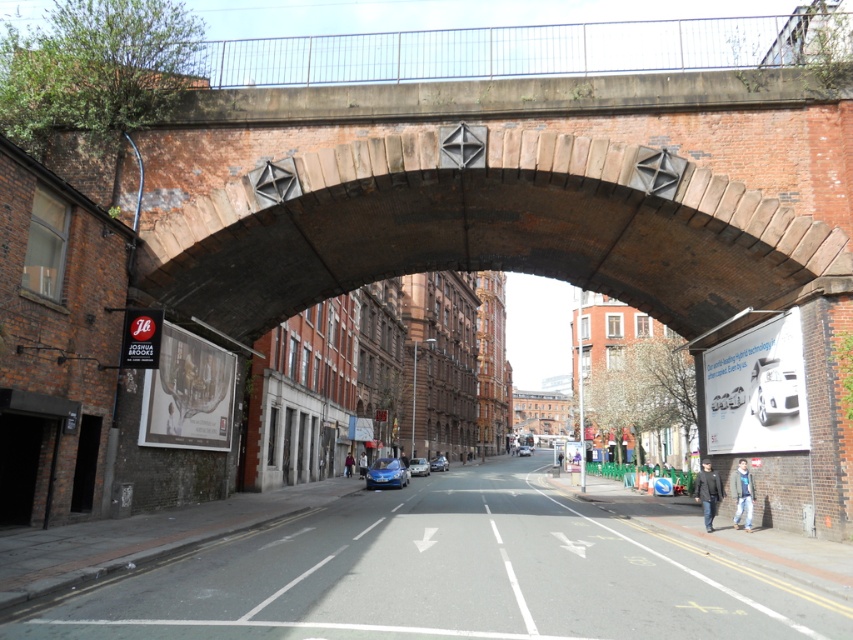
You are a delivery driver who needs to park your metallic blue car at center and blue metallic car at center side by side in a parking lot. Can both cars fit in a parking space that is 6 meters wide?

The metallic blue car at center is wider than the blue metallic car at center. However, without knowing their exact widths, it is impossible to determine if both can fit in a 6 meter wide space.

You are a pedestrian standing on the street under the bridge. You see a metallic blue car at center and a shiny blue sedan at center. Which vehicle is positioned higher relative to the other?

The metallic blue car at center is above the shiny blue sedan at center, so it is positioned higher.

You are a delivery driver needing to park your vehicle in this street scene. You have a metallic blue car at center and a shiny blue sedan at center. Which vehicle requires a wider parking space?

The metallic blue car at center requires a wider parking space than the shiny blue sedan at center because the description states that the metallic blue car at center might be wider than the shiny blue sedan at center.